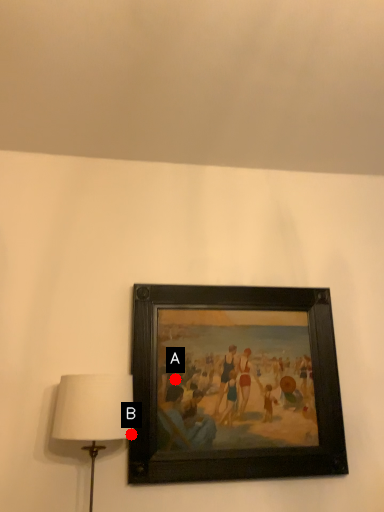
Question: Two points are circled on the image, labeled by A and B beside each circle. Which point is farther to the camera?

Choices:
 (A) A is further
 (B) B is further

Answer: (A)